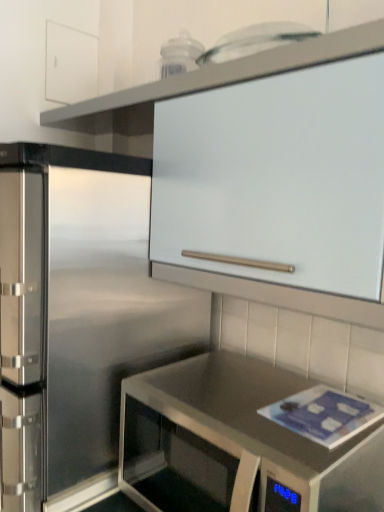
Question: Is stainless steel countertop at lower right oriented away from white matte cabinet at upper left, arranged as the 1th cabinetry when viewed from the top?

Choices:
 (A) yes
 (B) no

Answer: (B)

Question: Is stainless steel countertop at lower right not inside white matte cabinet at upper left, marked as the second cabinetry in a bottom-to-top arrangement?

Choices:
 (A) no
 (B) yes

Answer: (B)

Question: From a real-world perspective, is stainless steel countertop at lower right over white matte cabinet at upper left, marked as the second cabinetry in a bottom-to-top arrangement?

Choices:
 (A) yes
 (B) no

Answer: (B)

Question: Would you consider stainless steel countertop at lower right to be distant from white matte cabinet at upper left, positioned as the 2th cabinetry in right-to-left order?

Choices:
 (A) no
 (B) yes

Answer: (B)

Question: From the image's perspective, is stainless steel countertop at lower right located above white matte cabinet at upper left, marked as the second cabinetry in a bottom-to-top arrangement?

Choices:
 (A) no
 (B) yes

Answer: (A)

Question: From the image's perspective, is stainless steel countertop at lower right beneath white matte cabinet at upper left, arranged as the 1th cabinetry when viewed from the top?

Choices:
 (A) yes
 (B) no

Answer: (A)

Question: Is the depth of stainless steel countertop at lower right greater than that of white matte cabinet at upper center, placed as the 1th cabinetry when sorted from bottom to top?

Choices:
 (A) no
 (B) yes

Answer: (B)

Question: Considering the relative sizes of stainless steel countertop at lower right and white matte cabinet at upper center, acting as the 1th cabinetry starting from the right, in the image provided, is stainless steel countertop at lower right shorter than white matte cabinet at upper center, acting as the 1th cabinetry starting from the right,?

Choices:
 (A) no
 (B) yes

Answer: (B)

Question: Can you confirm if stainless steel countertop at lower right is wider than white matte cabinet at upper center, acting as the 2th cabinetry starting from the back?

Choices:
 (A) yes
 (B) no

Answer: (A)

Question: Does stainless steel countertop at lower right have a greater height compared to white matte cabinet at upper center, acting as the 2th cabinetry starting from the back?

Choices:
 (A) no
 (B) yes

Answer: (A)

Question: Considering the relative positions of stainless steel countertop at lower right and white matte cabinet at upper center, acting as the 1th cabinetry starting from the right, in the image provided, is stainless steel countertop at lower right to the right of white matte cabinet at upper center, acting as the 1th cabinetry starting from the right, from the viewer's perspective?

Choices:
 (A) yes
 (B) no

Answer: (A)

Question: Does stainless steel countertop at lower right touch white matte cabinet at upper center, the first cabinetry in the front-to-back sequence?

Choices:
 (A) no
 (B) yes

Answer: (A)

Question: From a real-world perspective, is white matte cabinet at upper center, placed as the 1th cabinetry when sorted from bottom to top, under stainless steel countertop at lower right?

Choices:
 (A) yes
 (B) no

Answer: (B)